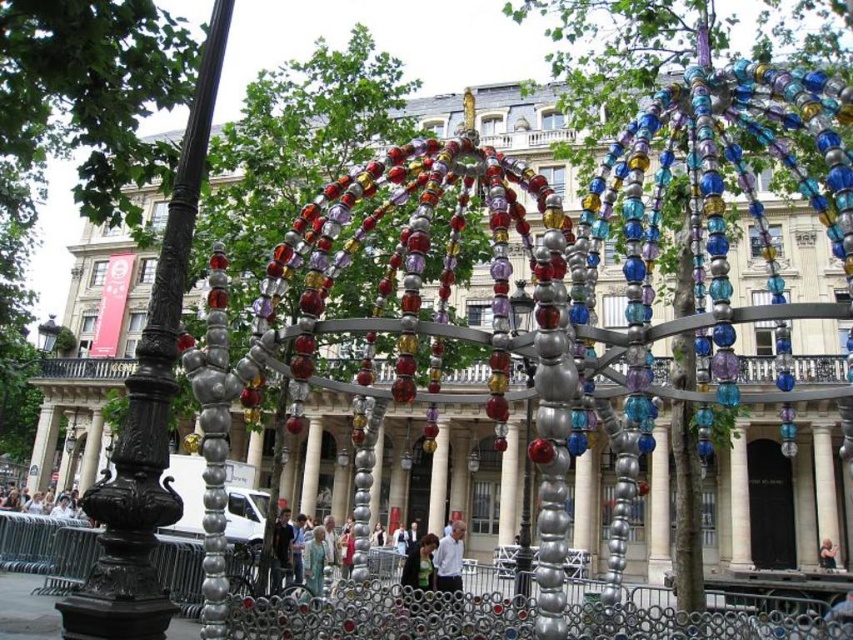
You are standing in the plaza and see the green fabric dress at center and the light brown leather jacket at center. Which one is nearer to you?

The green fabric dress at center is closer to the viewer than the light brown leather jacket at center.

You are standing in the plaza and want to find the green fabric dress at center. According to the coordinates provided, where exactly is it located in the image?

The green fabric dress at center is located at the 2D coordinates point (418, 568) in the image.